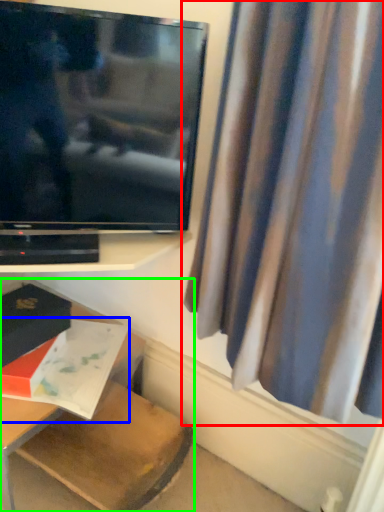
Question: Which is nearer to the curtain (highlighted by a red box)? book (highlighted by a blue box) or furniture (highlighted by a green box).

Choices:
 (A) book
 (B) furniture

Answer: (A)